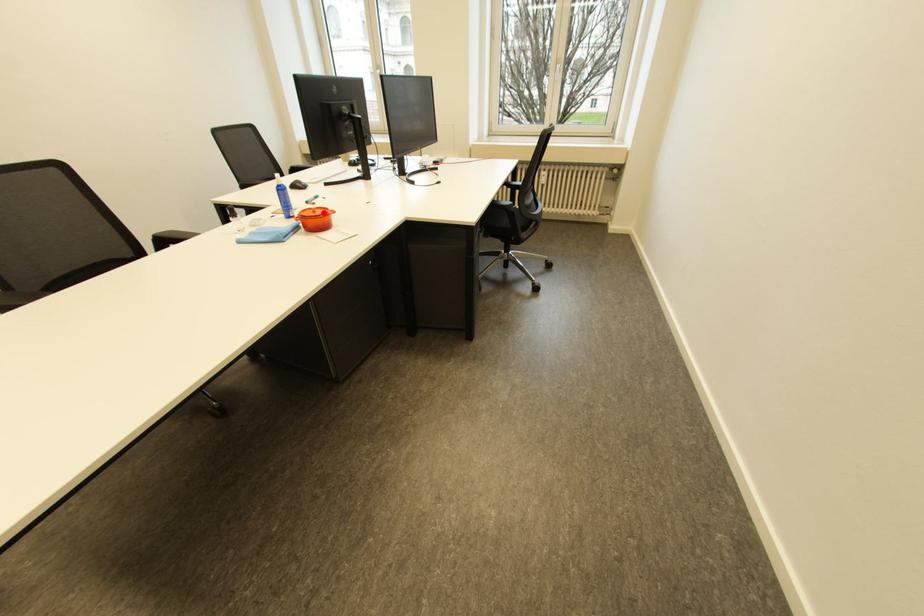
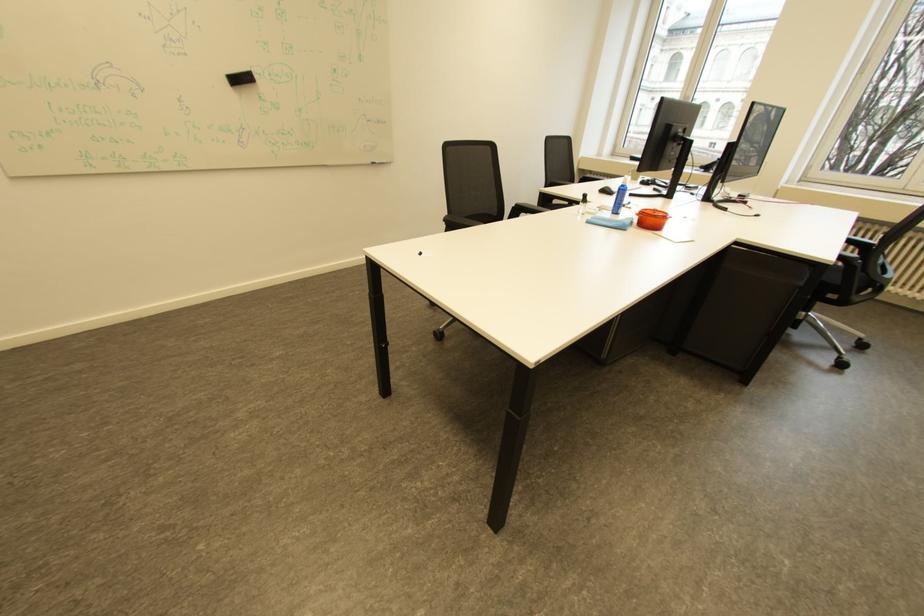
Find the pixel in the second image that matches the highlighted location in the first image.

(664, 213)